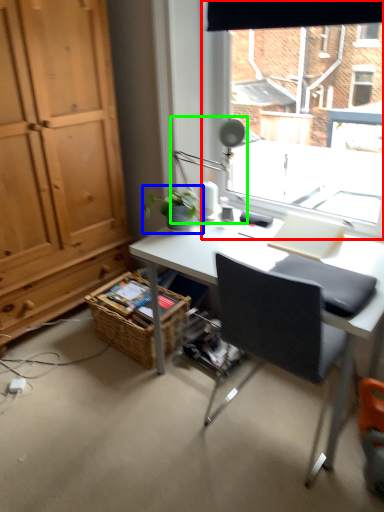
Question: Which is farther away from window (highlighted by a red box)? houseplant (highlighted by a blue box) or table lamp (highlighted by a green box)?

Choices:
 (A) houseplant
 (B) table lamp

Answer: (A)